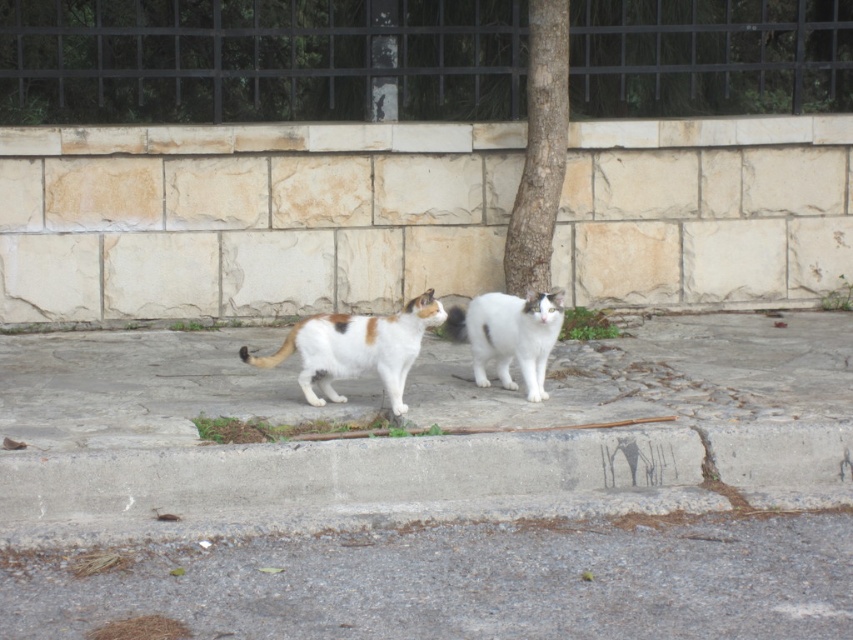
You are standing at the edge of the sidewalk and want to step onto the gray asphalt at lower center. What coordinates should you aim for to reach it?

The gray asphalt at lower center is located at coordinates point (463,580), so you should aim for those coordinates to reach it.

You are standing on the sidewalk and see the concrete at lower center and the white fluffy cat at center. Which object is closer to you?

The concrete at lower center is closer to you because it is in front of the white fluffy cat at center.